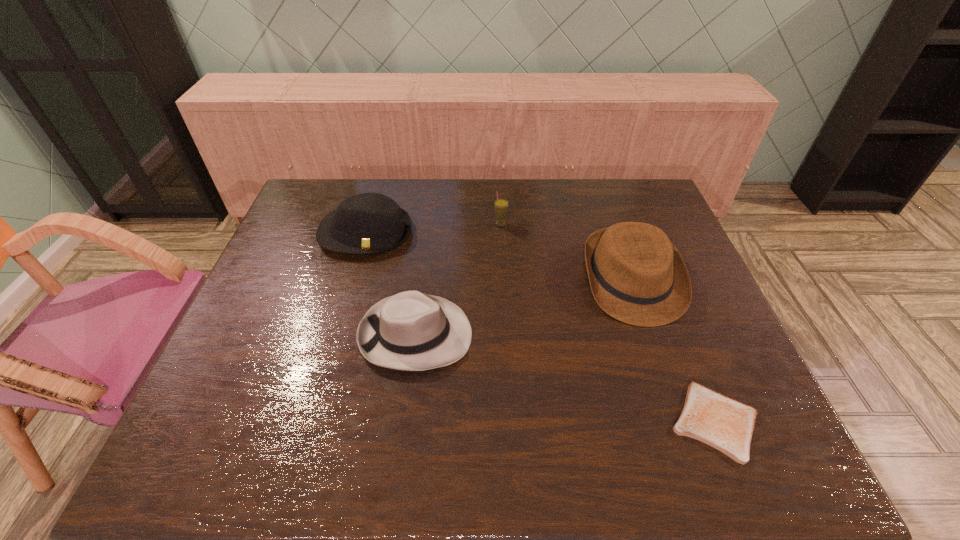
The image size is (960, 540). I want to click on straw for drinking, so click(501, 205).

The height and width of the screenshot is (540, 960). I want to click on the rightmost fedora, so click(x=637, y=276).

At what (x,y) coordinates should I click in order to perform the action: click on the nearest object. Please return your answer as a coordinate pair (x, y). This screenshot has width=960, height=540. Looking at the image, I should click on (724, 423).

What are the coordinates of `the shortest object` in the screenshot? It's located at (724, 423).

Image resolution: width=960 pixels, height=540 pixels. I want to click on vacant space located 0.400m on the front of the third object from right to left, so click(x=506, y=330).

I want to click on vacant area situated 0.050m on the front-facing side of the rightmost fedora, so click(x=655, y=343).

Identify the location of vacant space located on the back of the toast. The height and width of the screenshot is (540, 960). (670, 309).

At what (x,y) coordinates should I click in order to perform the action: click on straw for drinking that is at the far edge. Please return your answer as a coordinate pair (x, y). The height and width of the screenshot is (540, 960). Looking at the image, I should click on (501, 205).

Locate an element on the screen. This screenshot has height=540, width=960. fedora that is at the far edge is located at coordinates (368, 223).

Find the location of a particular element. This screenshot has height=540, width=960. object that is at the near edge is located at coordinates (724, 423).